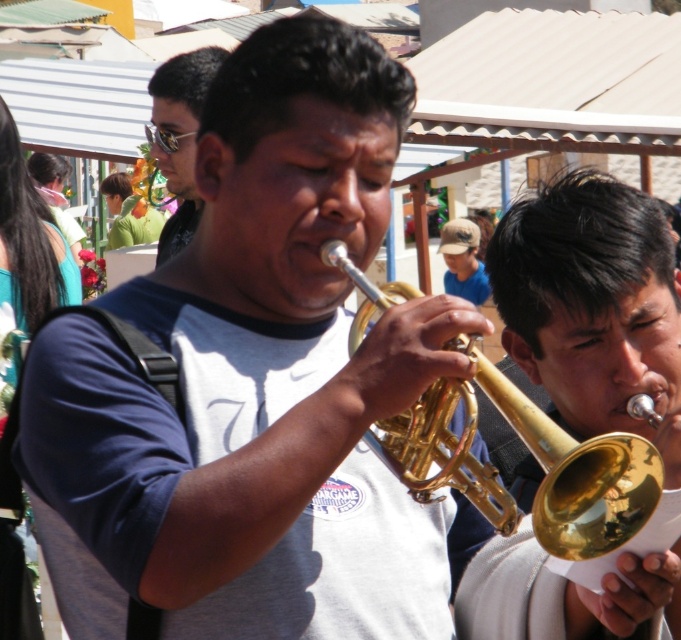
You are a photographer trying to capture the gold shiny trumpet at right in your shot. Based on its position coordinates, where should you aim your camera?

The gold shiny trumpet at right is located at coordinates point 0.480 on the x axis and 0.871 on the y axis.

You are a sound engineer setting up microphones for the gold shiny trumpet at right and the gray and blue t shirt man with trumpet at center. The microphones require a minimum distance of 10 meters between them to avoid feedback. Can you place the microphones at their respective positions?

The gold shiny trumpet at right and the gray and blue t shirt man with trumpet at center are 10.78 meters apart, which exceeds the required 10 meters. Therefore, the microphones can be placed without feedback issues.